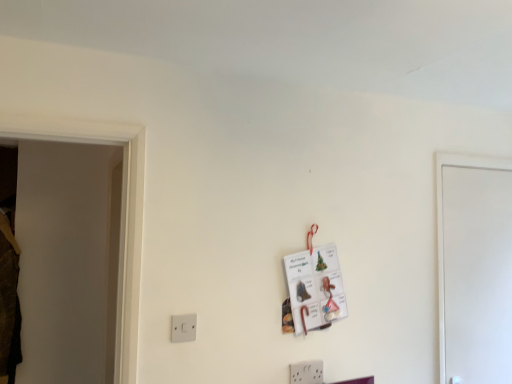
Find the location of `white matte door at right`. white matte door at right is located at coordinates (475, 275).

The image size is (512, 384). What do you see at coordinates (475, 275) in the screenshot? I see `white matte door at right` at bounding box center [475, 275].

What do you see at coordinates (183, 328) in the screenshot? The height and width of the screenshot is (384, 512). I see `white plastic light switch at lower left` at bounding box center [183, 328].

I want to click on white plastic light switch at lower left, so click(x=183, y=328).

At what (x,y) coordinates should I click in order to perform the action: click on white matte door at right. Please return your answer as a coordinate pair (x, y). Looking at the image, I should click on (475, 275).

Considering the relative positions of white matte door at right and white plastic light switch at lower left in the image provided, is white matte door at right to the left or to the right of white plastic light switch at lower left?

Based on their positions, white matte door at right is located to the right of white plastic light switch at lower left.

Is white matte door at right in front of or behind white plastic light switch at lower left in the image?

Visually, white matte door at right is located behind white plastic light switch at lower left.

Is point (474, 374) farther from viewer compared to point (182, 341)?

Yes, it is.

From the image's perspective, is white matte door at right located above or below white plastic light switch at lower left?

Clearly, from the image's perspective, white matte door at right is above white plastic light switch at lower left.

From a real-world perspective, is white matte door at right positioned under white plastic light switch at lower left based on gravity?

No.

In the scene shown: Which object is wider, white matte door at right or white plastic light switch at lower left?

white matte door at right.

Does white matte door at right have a lesser height compared to white plastic light switch at lower left?

No.

Can you confirm if white matte door at right is smaller than white plastic light switch at lower left?

No.

Is white matte door at right outside of white plastic light switch at lower left?

Absolutely, white matte door at right is external to white plastic light switch at lower left.

Is white matte door at right positioned far away from white plastic light switch at lower left?

Absolutely, white matte door at right is distant from white plastic light switch at lower left.

Is white matte door at right looking in the opposite direction of white plastic light switch at lower left?

No, white plastic light switch at lower left is not at the back of white matte door at right.

What's the angular difference between white matte door at right and white plastic light switch at lower left's facing directions?

There is a 0.00834-degree angle between the facing directions of white matte door at right and white plastic light switch at lower left.

I want to click on door on the right of white plastic light switch at lower left, so click(x=475, y=275).

Considering the relative positions of white plastic light switch at lower left and white matte door at right in the image provided, is white plastic light switch at lower left to the left of white matte door at right from the viewer's perspective?

Yes.

Does white plastic light switch at lower left come behind white matte door at right?

No, it is in front of white matte door at right.

Does point (187, 323) appear closer or farther from the camera than point (438, 213)?

Point (187, 323).

From the image's perspective, is white plastic light switch at lower left under white matte door at right?

Yes, from the image's perspective, white plastic light switch at lower left is beneath white matte door at right.

From a real-world perspective, is white plastic light switch at lower left physically located above or below white matte door at right?

From a real-world perspective, white plastic light switch at lower left is physically below white matte door at right.

Considering the relative sizes of white plastic light switch at lower left and white matte door at right in the image provided, is white plastic light switch at lower left thinner than white matte door at right?

Correct, the width of white plastic light switch at lower left is less than that of white matte door at right.

Considering the relative sizes of white plastic light switch at lower left and white matte door at right in the image provided, is white plastic light switch at lower left shorter than white matte door at right?

Correct, white plastic light switch at lower left is not as tall as white matte door at right.

Considering the sizes of objects white plastic light switch at lower left and white matte door at right in the image provided, who is smaller, white plastic light switch at lower left or white matte door at right?

With smaller size is white plastic light switch at lower left.

Would you say white plastic light switch at lower left contains white matte door at right?

That's incorrect, white matte door at right is not inside white plastic light switch at lower left.

Is there a large distance between white plastic light switch at lower left and white matte door at right?

Yes, white plastic light switch at lower left and white matte door at right are quite far apart.

Is white plastic light switch at lower left oriented away from white matte door at right?

No.

How many degrees apart are the facing directions of white plastic light switch at lower left and white matte door at right?

There is a 0.00834-degree angle between the facing directions of white plastic light switch at lower left and white matte door at right.

Identify the location of light switch that appears below the white matte door at right (from a real-world perspective). This screenshot has width=512, height=384. (183, 328).

At what (x,y) coordinates should I click in order to perform the action: click on light switch that is on the left side of white matte door at right. Please return your answer as a coordinate pair (x, y). The image size is (512, 384). Looking at the image, I should click on (183, 328).

At what (x,y) coordinates should I click in order to perform the action: click on door behind the white plastic light switch at lower left. Please return your answer as a coordinate pair (x, y). The width and height of the screenshot is (512, 384). Looking at the image, I should click on (475, 275).